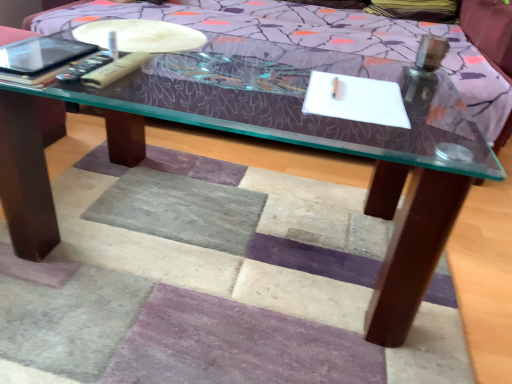
Question: Is matte black tablet at upper left surrounding black plastic remote at left, placed as the second remote when sorted from right to left?

Choices:
 (A) no
 (B) yes

Answer: (A)

Question: Is matte black tablet at upper left at the right side of black plastic remote at left, which ranks as the 1th remote in left-to-right order?

Choices:
 (A) no
 (B) yes

Answer: (A)

Question: Considering the relative sizes of matte black tablet at upper left and black plastic remote at left, which ranks as the 1th remote in left-to-right order, in the image provided, is matte black tablet at upper left bigger than black plastic remote at left, which ranks as the 1th remote in left-to-right order,?

Choices:
 (A) no
 (B) yes

Answer: (B)

Question: Does matte black tablet at upper left have a smaller size compared to black plastic remote at left, placed as the second remote when sorted from right to left?

Choices:
 (A) no
 (B) yes

Answer: (A)

Question: Does matte black tablet at upper left have a greater width compared to black plastic remote at left, which ranks as the 1th remote in left-to-right order?

Choices:
 (A) yes
 (B) no

Answer: (A)

Question: Is matte black tablet at upper left to the left of black plastic remote at left, placed as the second remote when sorted from right to left, from the viewer's perspective?

Choices:
 (A) no
 (B) yes

Answer: (B)

Question: Is the depth of black plastic remote at left, placed as the second remote when sorted from right to left, less than that of beige plastic remote at upper left, the first remote from the right?

Choices:
 (A) yes
 (B) no

Answer: (A)

Question: From a real-world perspective, is black plastic remote at left, placed as the second remote when sorted from right to left, located beneath beige plastic remote at upper left, which appears as the second remote when viewed from the left?

Choices:
 (A) yes
 (B) no

Answer: (B)

Question: Is black plastic remote at left, which ranks as the 1th remote in left-to-right order, further to the viewer compared to beige plastic remote at upper left, the first remote from the right?

Choices:
 (A) yes
 (B) no

Answer: (B)

Question: Can you confirm if black plastic remote at left, placed as the second remote when sorted from right to left, is smaller than beige plastic remote at upper left, the first remote from the right?

Choices:
 (A) no
 (B) yes

Answer: (A)

Question: From the image's perspective, would you say black plastic remote at left, which ranks as the 1th remote in left-to-right order, is positioned over beige plastic remote at upper left, the first remote from the right?

Choices:
 (A) no
 (B) yes

Answer: (A)

Question: Is black plastic remote at left, placed as the second remote when sorted from right to left, looking in the opposite direction of beige plastic remote at upper left, the first remote from the right?

Choices:
 (A) no
 (B) yes

Answer: (A)

Question: Considering the relative positions of matte black tablet at upper left and beige plastic remote at upper left, the first remote from the right, in the image provided, is matte black tablet at upper left to the right of beige plastic remote at upper left, the first remote from the right, from the viewer's perspective?

Choices:
 (A) no
 (B) yes

Answer: (A)